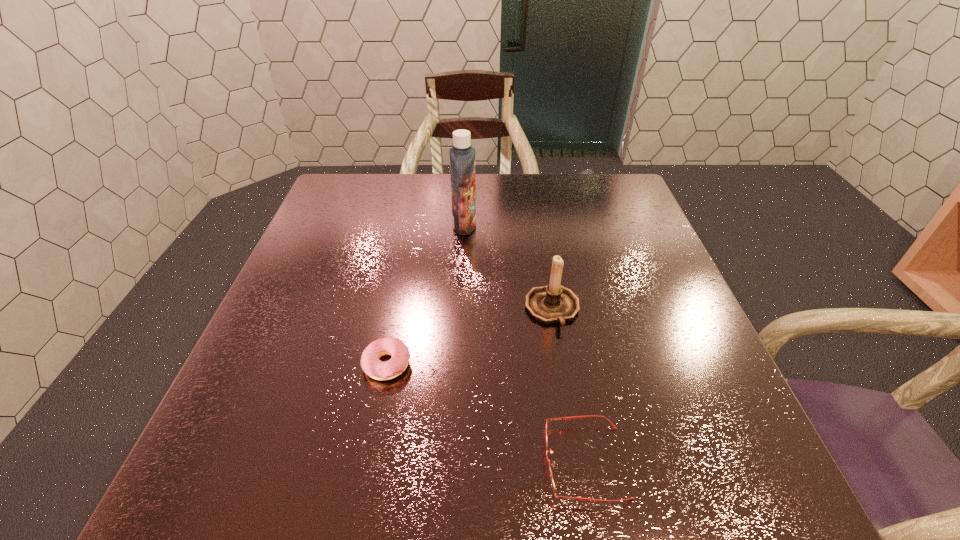
Locate an element on the screen. The height and width of the screenshot is (540, 960). the second object from left to right is located at coordinates (462, 155).

At what (x,y) coordinates should I click in order to perform the action: click on shampoo. Please return your answer as a coordinate pair (x, y). Looking at the image, I should click on (462, 155).

Find the location of a particular element. the third nearest object is located at coordinates (554, 303).

The height and width of the screenshot is (540, 960). Identify the location of the second tallest object. (554, 303).

Where is `the leftmost object`? This screenshot has width=960, height=540. the leftmost object is located at coordinates (371, 365).

Where is `the second nearest object`? This screenshot has width=960, height=540. the second nearest object is located at coordinates (371, 365).

At what (x,y) coordinates should I click in order to perform the action: click on spectacles. Please return your answer as a coordinate pair (x, y). The image size is (960, 540). Looking at the image, I should click on tap(572, 417).

Locate an element on the screen. The height and width of the screenshot is (540, 960). free space located on the front label of the shampoo is located at coordinates (502, 225).

The height and width of the screenshot is (540, 960). In order to click on vacant space situated on the left of the second tallest object in this screenshot , I will do `click(419, 309)`.

Where is `free region located 0.050m on the front of the doughnut`? free region located 0.050m on the front of the doughnut is located at coordinates (378, 409).